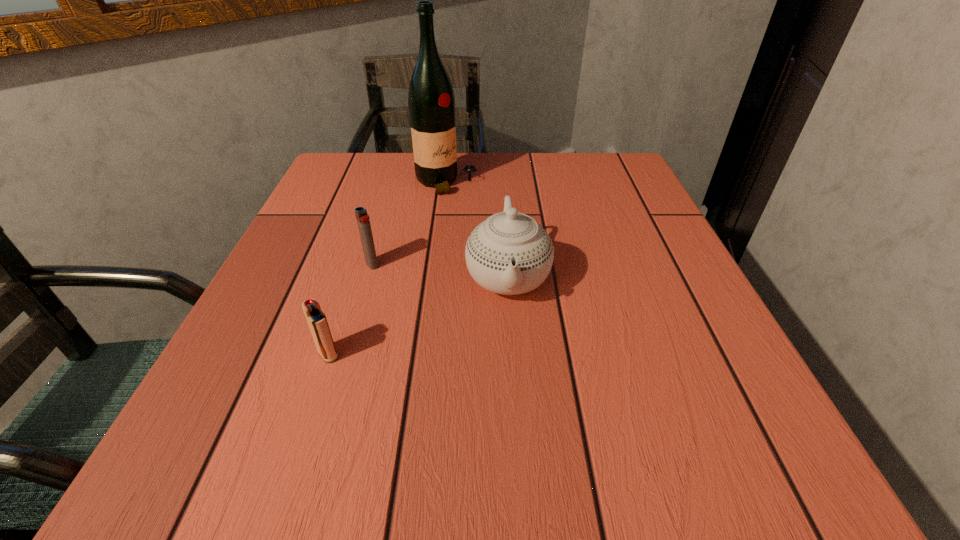
The width and height of the screenshot is (960, 540). I want to click on object present at the left edge, so pos(316,319).

This screenshot has height=540, width=960. I want to click on free space at the far edge of the desktop, so click(399, 161).

In the image, there is a desktop. Where is `vacant space at the left edge`? vacant space at the left edge is located at coordinates (234, 387).

This screenshot has width=960, height=540. Find the location of `free space at the right edge`. free space at the right edge is located at coordinates (650, 222).

What are the coordinates of `free space at the far left corner of the desktop` in the screenshot? It's located at (370, 174).

At what (x,y) coordinates should I click in order to perform the action: click on vacant space at the near left corner of the desktop. Please return your answer as a coordinate pair (x, y). This screenshot has width=960, height=540. Looking at the image, I should click on (254, 449).

Find the location of a particular element. The image size is (960, 540). free location at the far right corner is located at coordinates (606, 191).

Image resolution: width=960 pixels, height=540 pixels. In the image, there is a desktop. In order to click on free space at the near right corner in this screenshot , I will do `click(695, 440)`.

Image resolution: width=960 pixels, height=540 pixels. Identify the location of vacant area that lies between the nearest object and the farthest object. (388, 268).

Identify the location of free space between the nearest object and the wine bottle. (388, 268).